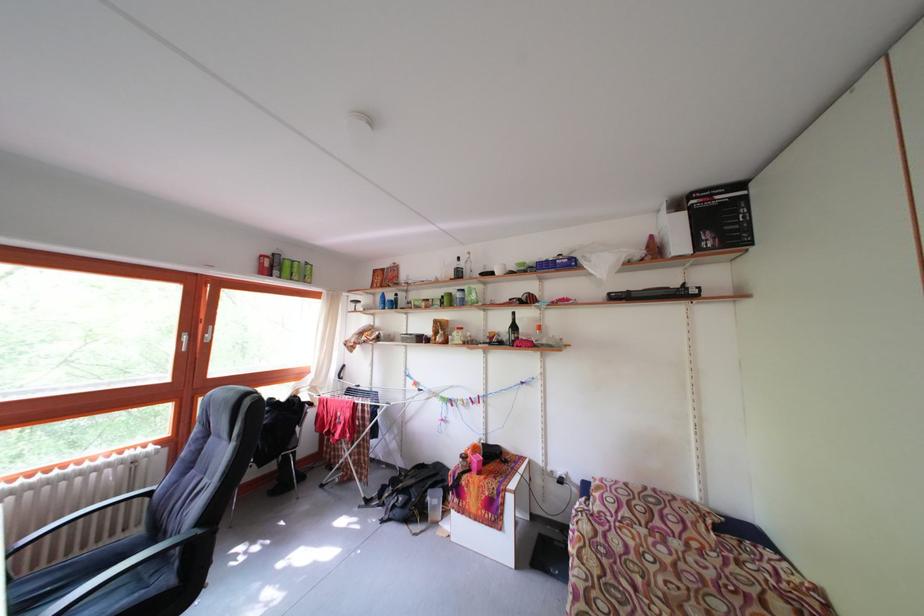
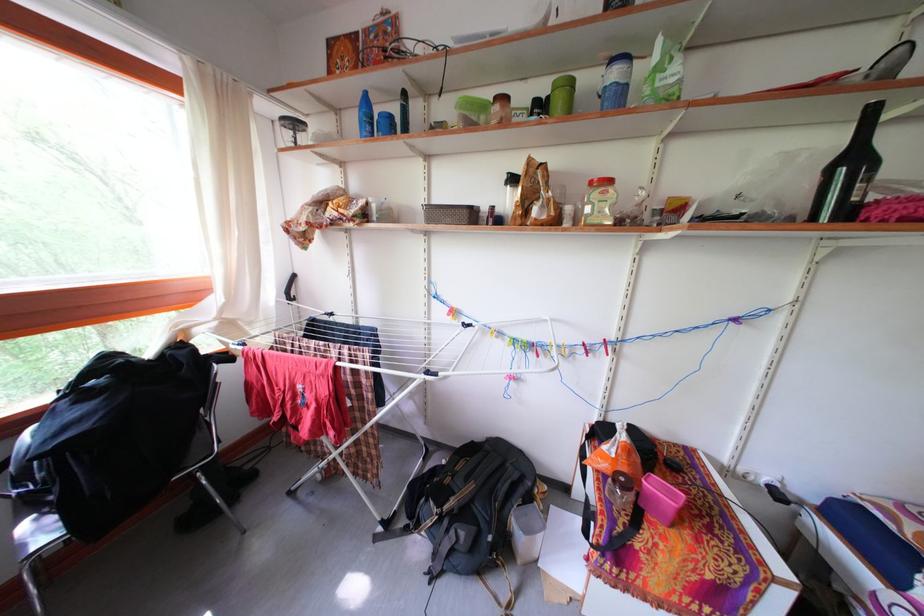
The point at (523, 333) is marked in the first image. Where is the corresponding point in the second image?

(861, 166)